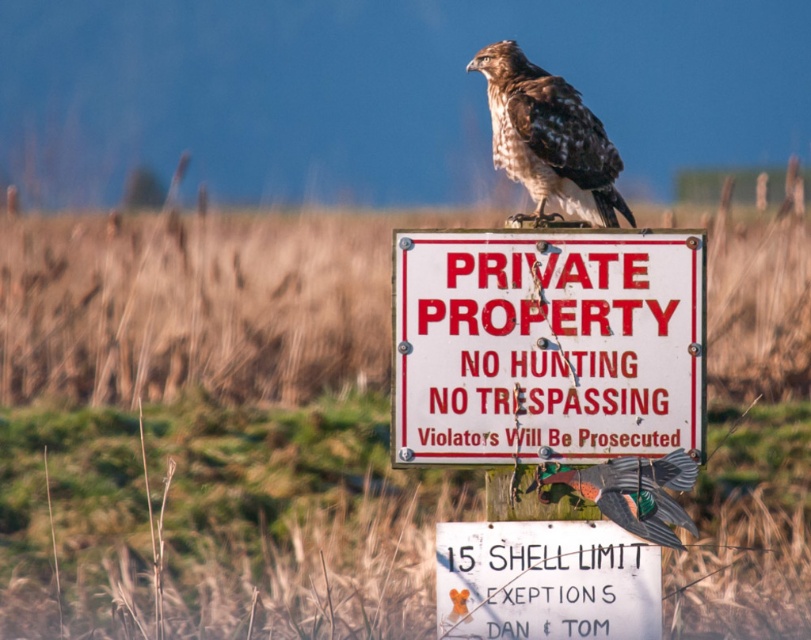
Can you confirm if brown speckled feathers at center is positioned above metallic gray bird at center?

Yes.

Measure the distance between point (513, 161) and camera.

Point (513, 161) is 4.87 meters from camera.

The height and width of the screenshot is (640, 811). In order to click on brown speckled feathers at center in this screenshot , I will do `click(548, 138)`.

Is point (388, 294) more distant than point (620, 435)?

Yes.

Is brown wooden sign at center below white painted metal sign at center?

No, brown wooden sign at center is not below white painted metal sign at center.

Measure the distance between point (x=299, y=257) and camera.

Point (x=299, y=257) is 76.12 feet away from camera.

Locate an element on the screen. This screenshot has width=811, height=640. brown wooden sign at center is located at coordinates (209, 428).

Is white paper sign at center below metallic gray bird at center?

Yes.

Can you confirm if white paper sign at center is smaller than metallic gray bird at center?

Yes, white paper sign at center is smaller than metallic gray bird at center.

Describe the element at coordinates (545, 580) in the screenshot. Image resolution: width=811 pixels, height=640 pixels. I see `white paper sign at center` at that location.

In order to click on white paper sign at center in this screenshot , I will do `click(545, 580)`.